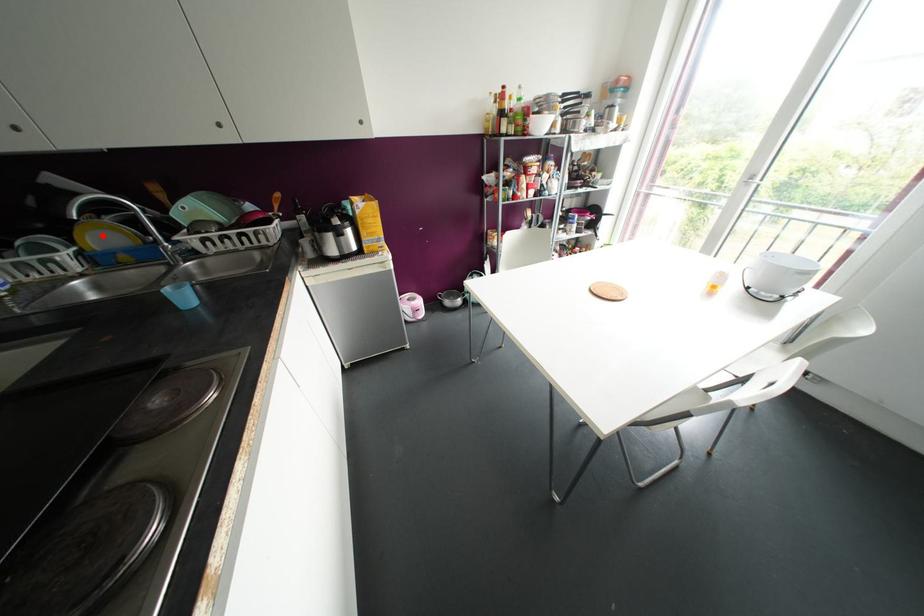
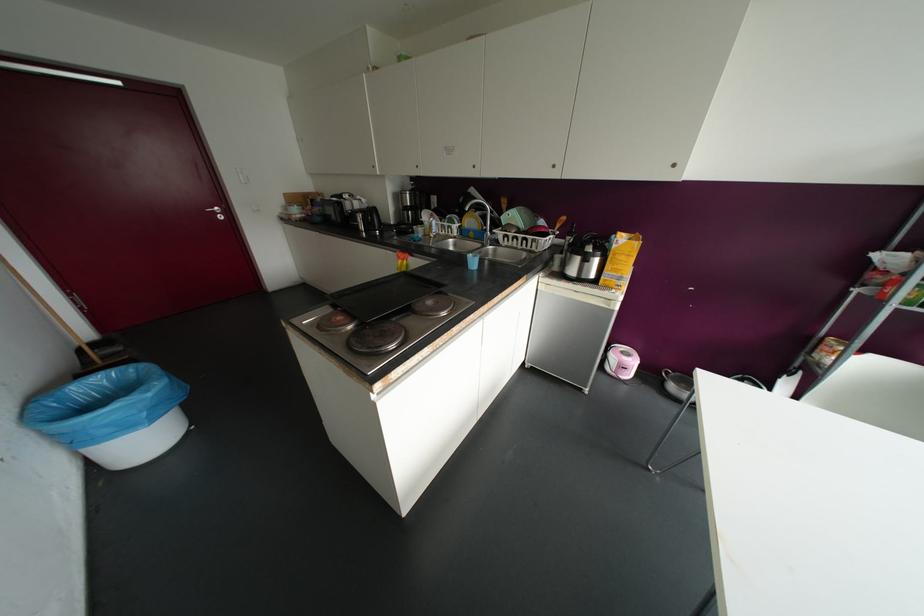
In the second image, find the point that corresponds to the highlighted location in the first image.

(469, 221)